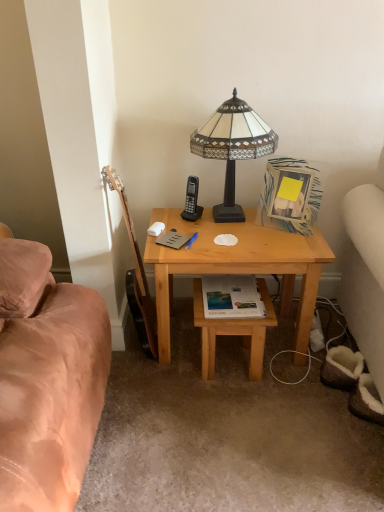
At what (x,y) coordinates should I click in order to perform the action: click on vacant area to the right of black plastic phone at center. Please return your answer as a coordinate pair (x, y). The width and height of the screenshot is (384, 512). Looking at the image, I should click on (234, 217).